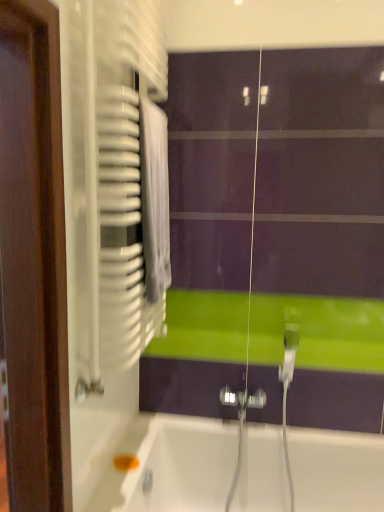
Question: Considering the positions of point (289, 507) and point (140, 74), is point (289, 507) closer or farther from the camera than point (140, 74)?

Choices:
 (A) closer
 (B) farther

Answer: (B)

Question: In the image, is white glossy bathtub at lower center positioned in front of or behind white plastic radiator at left?

Choices:
 (A) front
 (B) behind

Answer: (B)

Question: Is white glossy bathtub at lower center bigger or smaller than white plastic radiator at left?

Choices:
 (A) big
 (B) small

Answer: (A)

Question: From the image's perspective, is white plastic radiator at left above or below white glossy bathtub at lower center?

Choices:
 (A) below
 (B) above

Answer: (B)

Question: Is white plastic radiator at left inside or outside of white glossy bathtub at lower center?

Choices:
 (A) outside
 (B) inside

Answer: (A)

Question: In the image, is white plastic radiator at left positioned in front of or behind white glossy bathtub at lower center?

Choices:
 (A) front
 (B) behind

Answer: (A)

Question: Considering the positions of point (99, 435) and point (178, 508), is point (99, 435) closer or farther from the camera than point (178, 508)?

Choices:
 (A) farther
 (B) closer

Answer: (B)